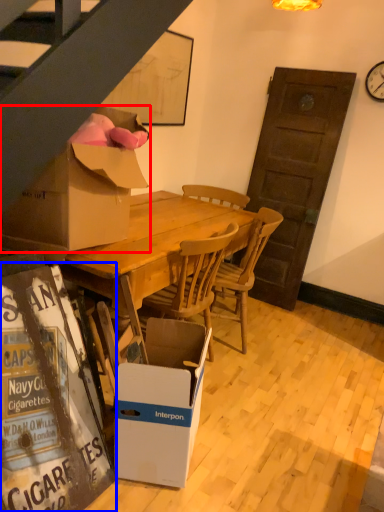
Question: Which object appears closest to the camera in this image, box (highlighted by a red box) or bulletin board (highlighted by a blue box)?

Choices:
 (A) box
 (B) bulletin board

Answer: (B)